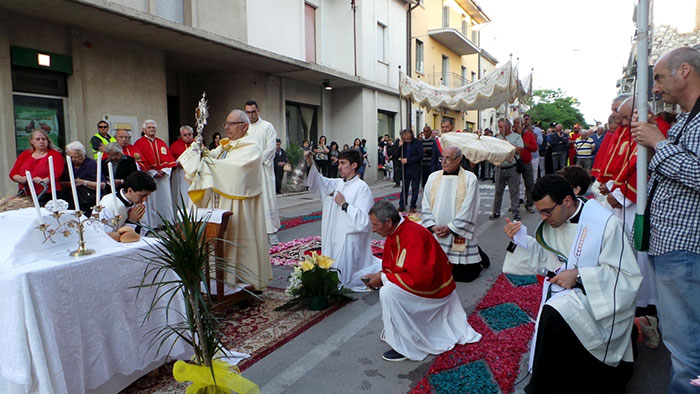
Locate an element on the screen. This screenshot has width=700, height=394. plant is located at coordinates (197, 303).